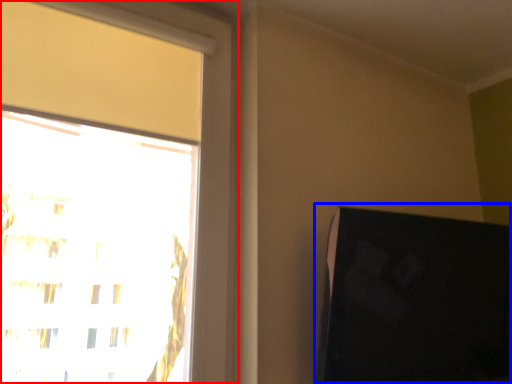
Question: Among these objects, which one is nearest to the camera, window (highlighted by a red box) or computer monitor (highlighted by a blue box)?

Choices:
 (A) window
 (B) computer monitor

Answer: (A)